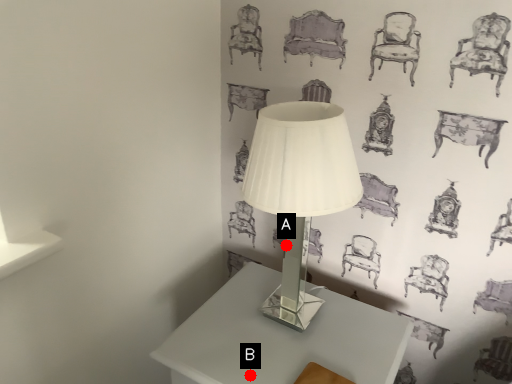
Question: Two points are circled on the image, labeled by A and B beside each circle. Which point is further to the camera?

Choices:
 (A) A is further
 (B) B is further

Answer: (A)